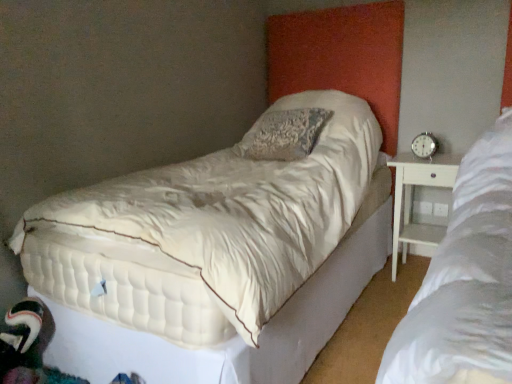
Question: Looking at their shapes, would you say white quilted mattress at center is wider or thinner than silver metallic alarm clock at right?

Choices:
 (A) thin
 (B) wide

Answer: (B)

Question: In the image, is white quilted mattress at center on the left side or the right side of silver metallic alarm clock at right?

Choices:
 (A) left
 (B) right

Answer: (A)

Question: Based on their relative distances, which object is nearer to the silver metallic alarm clock at right?

Choices:
 (A) white quilted mattress at center
 (B) white wood nightstand at right

Answer: (B)

Question: Which object is positioned farthest from the white quilted mattress at center?

Choices:
 (A) silver metallic alarm clock at right
 (B) white wood nightstand at right

Answer: (A)